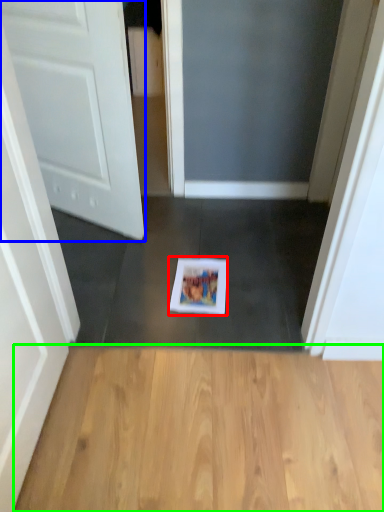
Question: Considering the real-world distances, which object is closest to copy (highlighted by a red box)? door (highlighted by a blue box) or hardwood (highlighted by a green box).

Choices:
 (A) door
 (B) hardwood

Answer: (B)